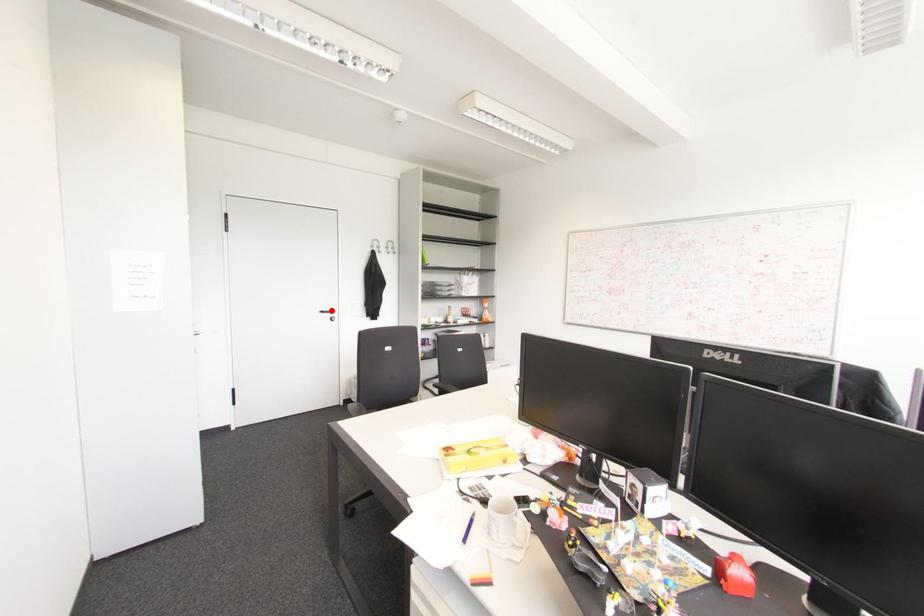
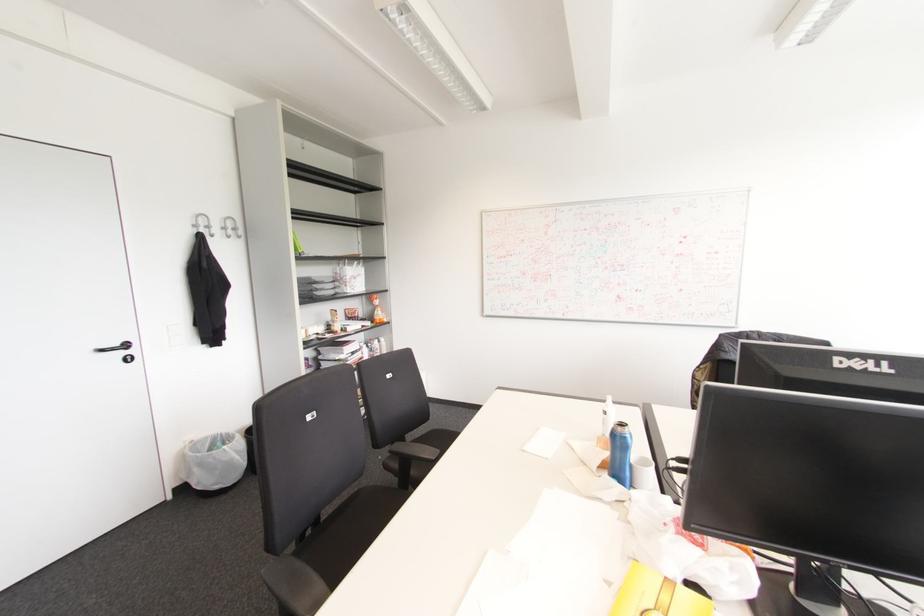
Locate, in the second image, the point that corresponds to the highlighted location in the first image.

(126, 345)